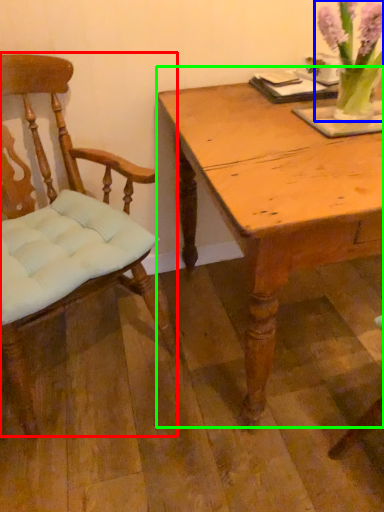
Question: Considering the real-world distances, which object is closest to chair (highlighted by a red box)? floral arrangement (highlighted by a blue box) or table (highlighted by a green box).

Choices:
 (A) floral arrangement
 (B) table

Answer: (B)